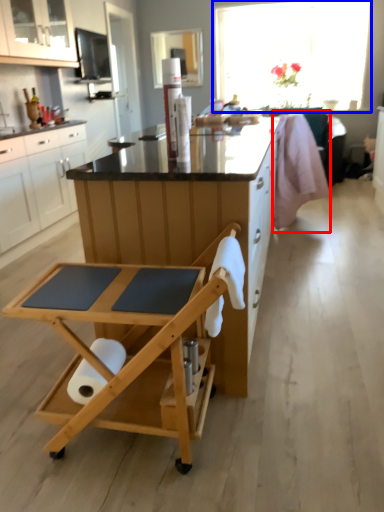
Question: Which of the following is the farthest to the observer, swivel chair (highlighted by a red box) or window (highlighted by a blue box)?

Choices:
 (A) swivel chair
 (B) window

Answer: (B)